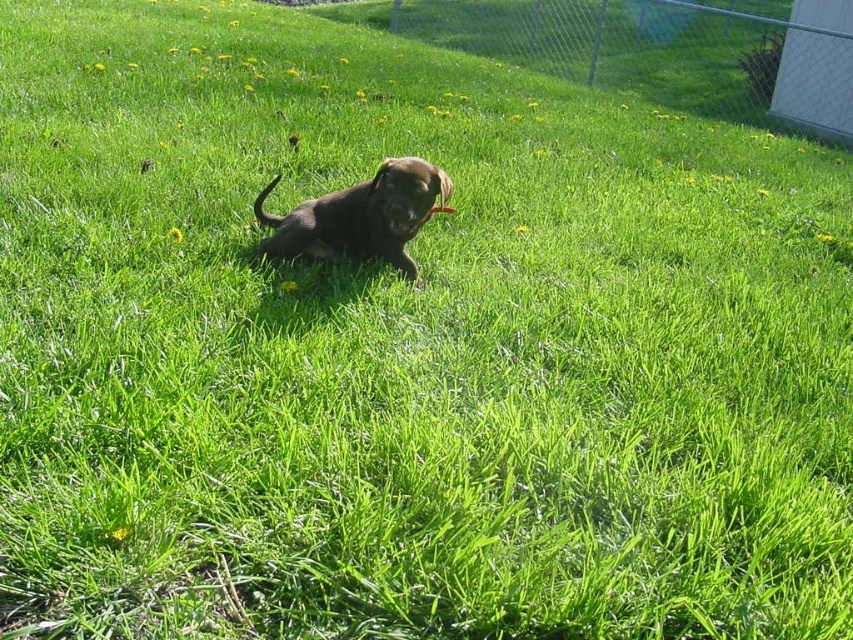
Which is above, metallic chain-link fence at upper right or shiny brown puppy at center?

metallic chain-link fence at upper right

Which is in front, point (659, 96) or point (343, 248)?

Point (343, 248)

Where is `metallic chain-link fence at upper right`? This screenshot has width=853, height=640. metallic chain-link fence at upper right is located at coordinates (659, 52).